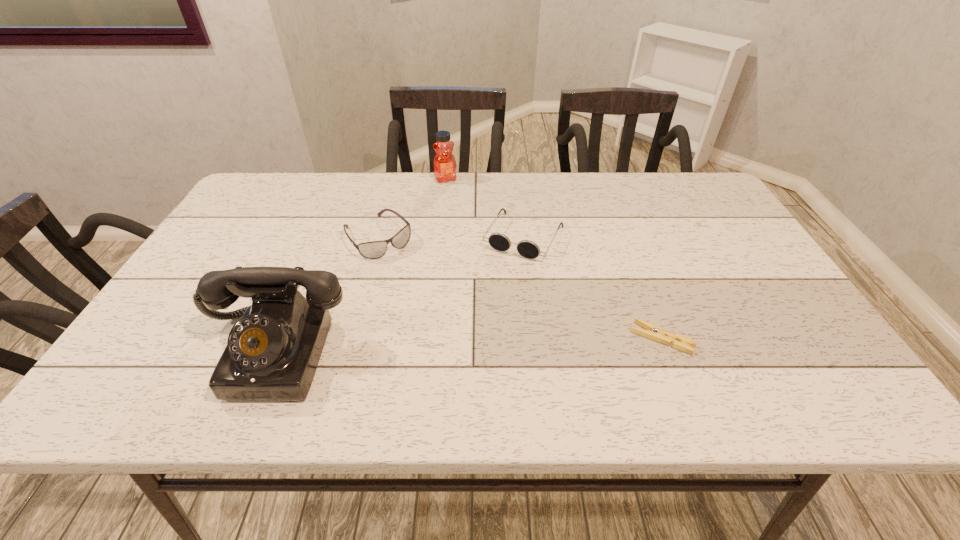
The width and height of the screenshot is (960, 540). Identify the location of vacant area located on the lenses of the left sunglasses. (412, 274).

Find the location of a particular element. The image size is (960, 540). free location located 0.080m on the front label of the farthest object is located at coordinates (454, 198).

Where is `vacant region located 0.070m on the front label of the farthest object`? vacant region located 0.070m on the front label of the farthest object is located at coordinates (453, 196).

Identify the location of free space located on the front label of the farthest object. The image size is (960, 540). (477, 251).

Locate an element on the screen. The height and width of the screenshot is (540, 960). free spot located on the front-facing side of the right sunglasses is located at coordinates click(x=485, y=306).

Where is `vacant space situated on the front-facing side of the right sunglasses`? This screenshot has height=540, width=960. vacant space situated on the front-facing side of the right sunglasses is located at coordinates (498, 282).

This screenshot has height=540, width=960. What are the coordinates of `vacant space located on the front-facing side of the right sunglasses` in the screenshot? It's located at (498, 282).

Locate an element on the screen. Image resolution: width=960 pixels, height=540 pixels. honey that is positioned at the far edge is located at coordinates (444, 161).

You are a GUI agent. You are given a task and a screenshot of the screen. Output one action in this format:
    pyautogui.click(x=<x>, y=<y>)
    Task: Click on the sunglasses positioned at the far edge
    The width and height of the screenshot is (960, 540).
    Given the screenshot: What is the action you would take?
    pyautogui.click(x=498, y=241)

Find the location of a particular element. The image size is (960, 540). telephone that is at the near edge is located at coordinates (272, 353).